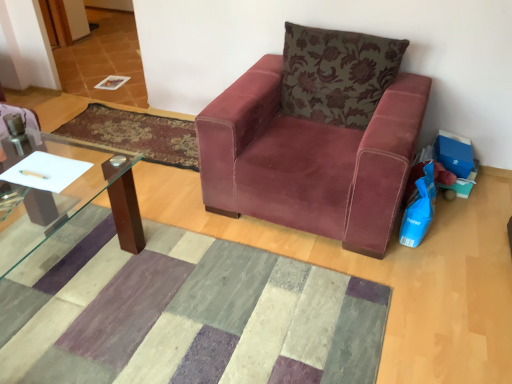
Question: From the image's perspective, is textured wool mat at center, the first mat positioned from the front, located above or below velvet-like burgundy mat at center, arranged as the first mat when viewed from the back?

Choices:
 (A) below
 (B) above

Answer: (A)

Question: Considering the relative positions of textured wool mat at center, the 2th mat viewed from the top, and velvet-like burgundy mat at center, arranged as the first mat when viewed from the back, in the image provided, is textured wool mat at center, the 2th mat viewed from the top, to the left or to the right of velvet-like burgundy mat at center, arranged as the first mat when viewed from the back,?

Choices:
 (A) right
 (B) left

Answer: (A)

Question: Which object is positioned farthest from the velvet-like burgundy mat at center, arranged as the first mat when viewed from the back?

Choices:
 (A) velvet maroon armchair at center
 (B) floral-patterned velvet pillow at upper right
 (C) textured wool mat at center, the first mat positioned from the front
 (D) metallic silver pen at lower left

Answer: (D)

Question: Which object is the closest to the floral-patterned velvet pillow at upper right?

Choices:
 (A) textured wool mat at center, arranged as the first mat when ordered from the bottom
 (B) metallic silver pen at lower left
 (C) velvet-like burgundy mat at center, arranged as the first mat when viewed from the back
 (D) velvet maroon armchair at center

Answer: (D)